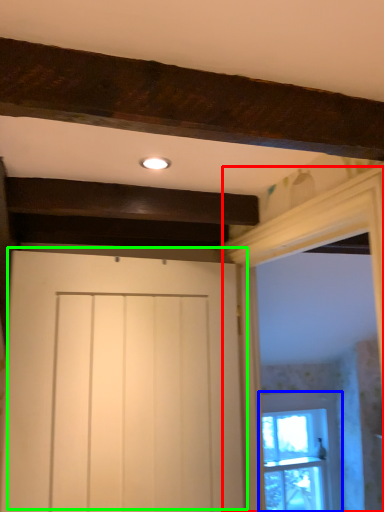
Question: Which object is positioned closest to window frame (highlighted by a red box)? Select from window (highlighted by a blue box) and door (highlighted by a green box).

Choices:
 (A) window
 (B) door

Answer: (B)